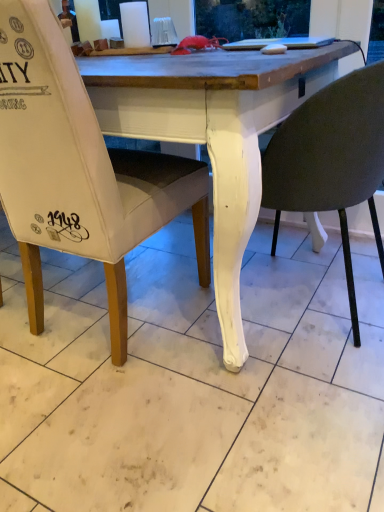
Locate an element on the screen. Image resolution: width=384 pixels, height=512 pixels. free point below white fabric chair at left, arranged as the second chair when viewed from the right (from a real-world perspective) is located at coordinates (126, 317).